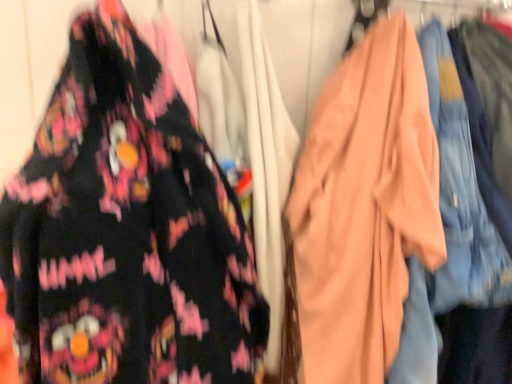
Question: Is matte black shirt at left touching matte peach robe at center?

Choices:
 (A) yes
 (B) no

Answer: (B)

Question: From a real-world perspective, is matte black shirt at left beneath matte peach robe at center?

Choices:
 (A) no
 (B) yes

Answer: (A)

Question: Is matte black shirt at left closer to camera compared to matte peach robe at center?

Choices:
 (A) yes
 (B) no

Answer: (A)

Question: Is there a large distance between matte black shirt at left and matte peach robe at center?

Choices:
 (A) no
 (B) yes

Answer: (A)

Question: Is matte black shirt at left wider than matte peach robe at center?

Choices:
 (A) no
 (B) yes

Answer: (A)

Question: Could you tell me if matte black shirt at left is facing matte peach robe at center?

Choices:
 (A) no
 (B) yes

Answer: (A)

Question: Considering the relative sizes of matte peach robe at center and matte black shirt at left in the image provided, is matte peach robe at center smaller than matte black shirt at left?

Choices:
 (A) yes
 (B) no

Answer: (B)

Question: Is matte peach robe at center oriented away from matte black shirt at left?

Choices:
 (A) yes
 (B) no

Answer: (B)

Question: From the image's perspective, is matte peach robe at center on top of matte black shirt at left?

Choices:
 (A) no
 (B) yes

Answer: (A)

Question: Does matte peach robe at center have a lesser width compared to matte black shirt at left?

Choices:
 (A) yes
 (B) no

Answer: (B)

Question: Can you confirm if matte peach robe at center is taller than matte black shirt at left?

Choices:
 (A) no
 (B) yes

Answer: (B)

Question: Considering the relative sizes of matte peach robe at center and matte black shirt at left in the image provided, is matte peach robe at center shorter than matte black shirt at left?

Choices:
 (A) yes
 (B) no

Answer: (B)

Question: From the image's perspective, is matte black shirt at left positioned above or below matte peach robe at center?

Choices:
 (A) above
 (B) below

Answer: (A)